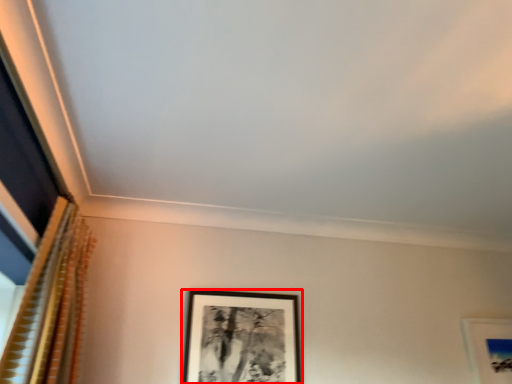
Question: From the image's perspective, what is the correct spatial relationship of picture frame (annotated by the red box) in relation to curtain?

Choices:
 (A) above
 (B) below

Answer: (B)